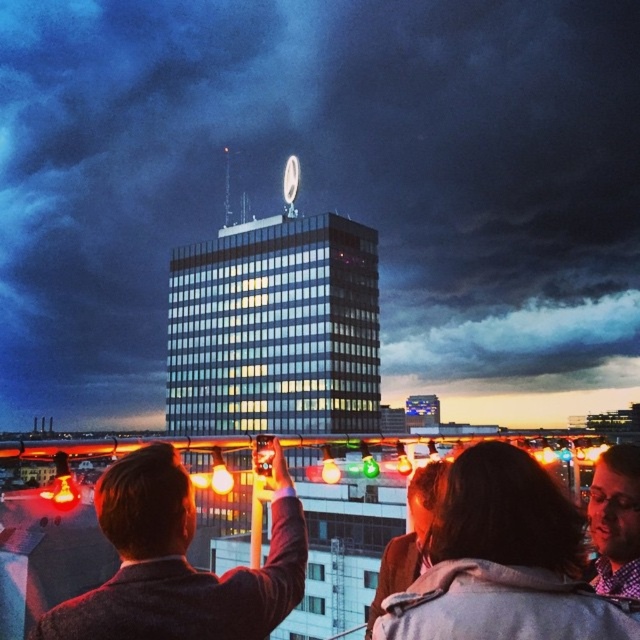
Does dark brown hair at center have a larger size compared to plaid shirt at lower right?

Yes.

Identify the location of dark brown hair at center. The width and height of the screenshot is (640, 640). (500, 561).

The height and width of the screenshot is (640, 640). Identify the location of dark brown hair at center. (500, 561).

Is dark brown hair at center below smooth brown jacket at upper left?

Yes, dark brown hair at center is below smooth brown jacket at upper left.

At what (x,y) coordinates should I click in order to perform the action: click on dark brown hair at center. Please return your answer as a coordinate pair (x, y). This screenshot has width=640, height=640. Looking at the image, I should click on (500, 561).

Can you confirm if smooth brown jacket at upper left is bigger than plaid shirt at lower right?

Yes.

What do you see at coordinates (179, 563) in the screenshot? This screenshot has width=640, height=640. I see `smooth brown jacket at upper left` at bounding box center [179, 563].

The width and height of the screenshot is (640, 640). What are the coordinates of `smooth brown jacket at upper left` in the screenshot? It's located at (179, 563).